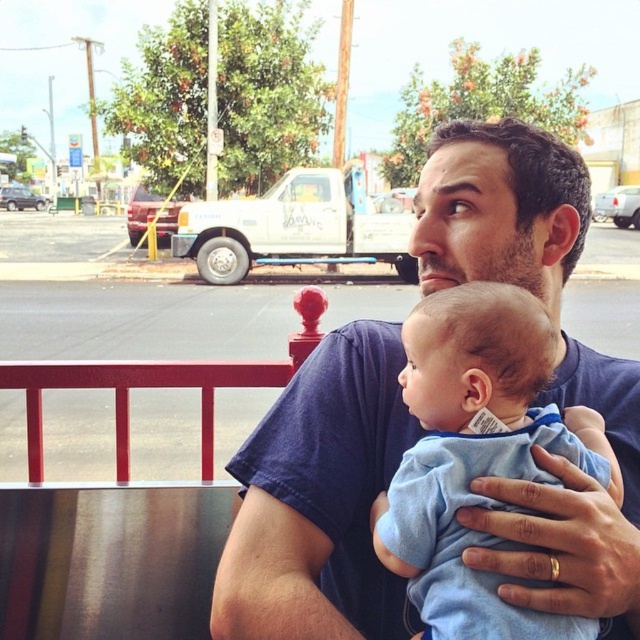
Question: Does blue cotton shirt at center appear over blue soft fabric baby at center?

Choices:
 (A) yes
 (B) no

Answer: (A)

Question: Which of the following is the closest to the observer?

Choices:
 (A) blue soft fabric baby at center
 (B) blue cotton shirt at center

Answer: (A)

Question: Is blue cotton shirt at center to the right of blue soft fabric baby at center from the viewer's perspective?

Choices:
 (A) no
 (B) yes

Answer: (A)

Question: Is blue cotton shirt at center above blue soft fabric baby at center?

Choices:
 (A) no
 (B) yes

Answer: (B)